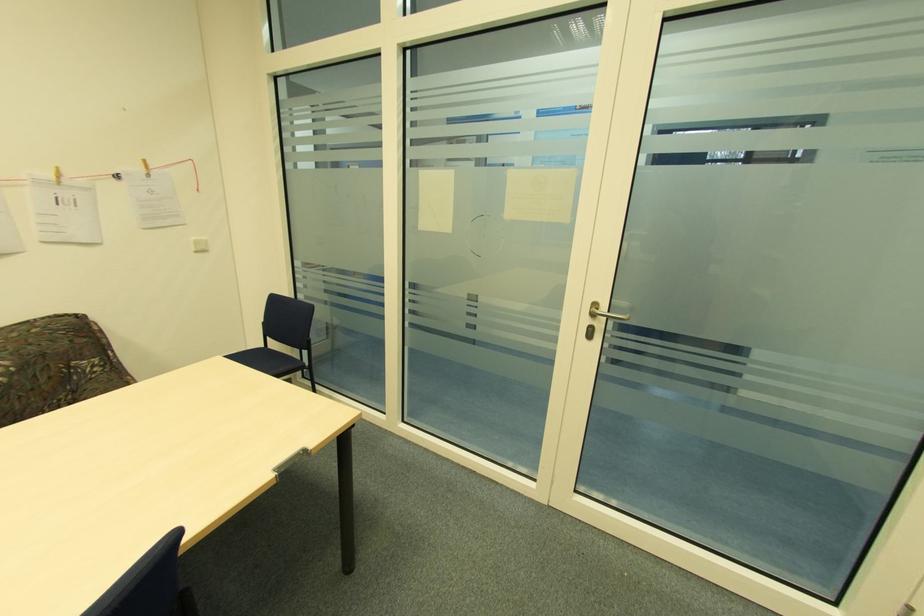
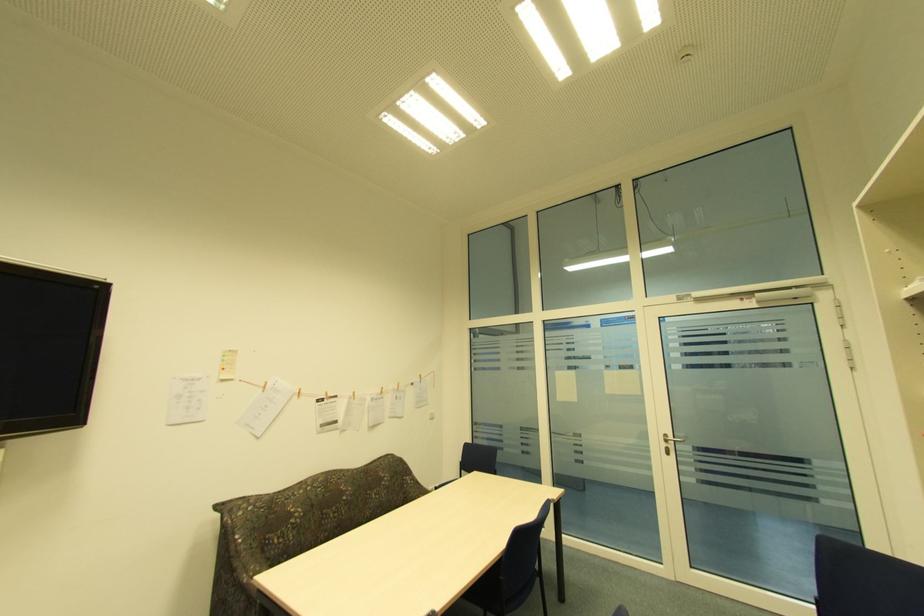
Find the pixel in the second image that matches pixel 589 321 in the first image.

(666, 445)